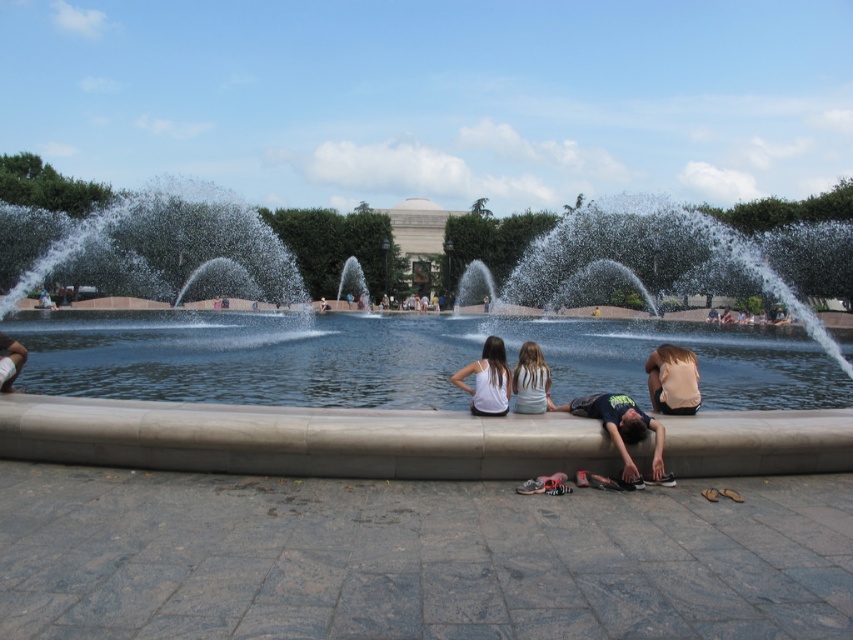
Question: Is clear glass water at center positioned behind white cotton shirt at lower left?

Choices:
 (A) yes
 (B) no

Answer: (B)

Question: Is clear glass water at center to the right of clear water at center from the viewer's perspective?

Choices:
 (A) yes
 (B) no

Answer: (B)

Question: Which point appears closest to the camera in this image?

Choices:
 (A) (653, 353)
 (B) (625, 417)
 (C) (517, 403)
 (D) (12, 390)

Answer: (B)

Question: Is clear glass water at center above clear water at center?

Choices:
 (A) no
 (B) yes

Answer: (B)

Question: Which of these objects is positioned closest to the white cotton shirt at center?

Choices:
 (A) clear glass water at center
 (B) white tank top at center
 (C) dark blue t-shirt at center

Answer: (B)

Question: Which of the following is the closest to the observer?

Choices:
 (A) dark blue t-shirt at center
 (B) white cotton shirt at center

Answer: (A)